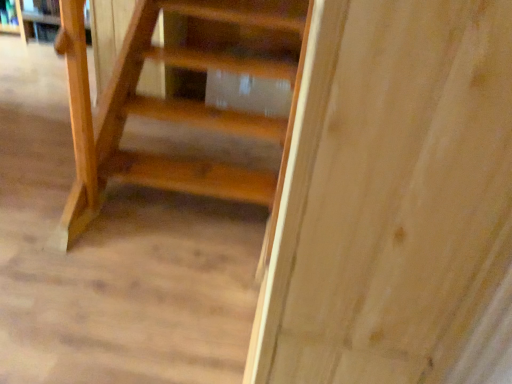
This screenshot has width=512, height=384. Describe the element at coordinates (42, 7) in the screenshot. I see `matte wooden book at upper left` at that location.

Identify the location of matte wooden book at upper left. (42, 7).

This screenshot has height=384, width=512. Describe the element at coordinates (23, 19) in the screenshot. I see `wooden shelf at upper left` at that location.

This screenshot has height=384, width=512. Find the location of `wooden shelf at upper left`. wooden shelf at upper left is located at coordinates (23, 19).

The width and height of the screenshot is (512, 384). What are the coordinates of `matte wooden book at upper left` in the screenshot? It's located at (42, 7).

Which is more to the right, matte wooden book at upper left or wooden shelf at upper left?

wooden shelf at upper left.

Between matte wooden book at upper left and wooden shelf at upper left, which one is positioned in front?

wooden shelf at upper left is in front.

Is point (32, 1) positioned in front of point (32, 22)?

That is True.

From the image's perspective, which one is positioned lower, matte wooden book at upper left or wooden shelf at upper left?

From the image's view, matte wooden book at upper left is below.

In the scene shown: From a real-world perspective, is matte wooden book at upper left physically located above or below wooden shelf at upper left?

In terms of real-world spatial position, matte wooden book at upper left is above wooden shelf at upper left.

Looking at this image, is matte wooden book at upper left wider or thinner than wooden shelf at upper left?

Considering their sizes, matte wooden book at upper left looks slimmer than wooden shelf at upper left.

Which of these two, matte wooden book at upper left or wooden shelf at upper left, stands taller?

With more height is wooden shelf at upper left.

In terms of size, does matte wooden book at upper left appear bigger or smaller than wooden shelf at upper left?

matte wooden book at upper left is smaller than wooden shelf at upper left.

Is matte wooden book at upper left completely or partially outside of wooden shelf at upper left?

No, matte wooden book at upper left is not outside of wooden shelf at upper left.

Is there a large distance between matte wooden book at upper left and wooden shelf at upper left?

A: No, matte wooden book at upper left is in close proximity to wooden shelf at upper left.

Is matte wooden book at upper left turned away from wooden shelf at upper left?

Yes, matte wooden book at upper left is positioned with its back facing wooden shelf at upper left.

How many degrees apart are the facing directions of matte wooden book at upper left and wooden shelf at upper left?

matte wooden book at upper left and wooden shelf at upper left are facing 0.078 degrees away from each other.

How far apart are matte wooden book at upper left and wooden shelf at upper left?

matte wooden book at upper left and wooden shelf at upper left are 10.36 centimeters apart from each other.

I want to click on shelf above the matte wooden book at upper left (from the image's perspective), so click(23, 19).

Which is more to the right, wooden shelf at upper left or matte wooden book at upper left?

Positioned to the right is wooden shelf at upper left.

Is the position of wooden shelf at upper left more distant than that of matte wooden book at upper left?

No.

Considering the positions of points (52, 21) and (51, 6), is point (52, 21) closer to camera compared to point (51, 6)?

No, it is not.

From the image's perspective, which object appears higher, wooden shelf at upper left or matte wooden book at upper left?

wooden shelf at upper left.

From a real-world perspective, is wooden shelf at upper left located higher than matte wooden book at upper left?

Actually, wooden shelf at upper left is physically below matte wooden book at upper left in the real world.

Which object is wider, wooden shelf at upper left or matte wooden book at upper left?

Wider between the two is wooden shelf at upper left.

Does wooden shelf at upper left have a greater height compared to matte wooden book at upper left?

Indeed, wooden shelf at upper left has a greater height compared to matte wooden book at upper left.

Is wooden shelf at upper left smaller than matte wooden book at upper left?

No, wooden shelf at upper left is not smaller than matte wooden book at upper left.

Is matte wooden book at upper left located within wooden shelf at upper left?

Yes, matte wooden book at upper left is a part of wooden shelf at upper left.

Is wooden shelf at upper left touching matte wooden book at upper left?

No, wooden shelf at upper left is not touching matte wooden book at upper left.

Is wooden shelf at upper left turned away from matte wooden book at upper left?

wooden shelf at upper left does not have its back to matte wooden book at upper left.

Can you tell me how much wooden shelf at upper left and matte wooden book at upper left differ in facing direction?

They differ by 0.078 degrees in their facing directions.

Locate an element on the screen. Image resolution: width=512 pixels, height=384 pixels. book below the wooden shelf at upper left (from the image's perspective) is located at coordinates (42, 7).

Locate an element on the screen. Image resolution: width=512 pixels, height=384 pixels. shelf in front of the matte wooden book at upper left is located at coordinates (23, 19).

Where is `shelf on the right of the matte wooden book at upper left`? This screenshot has width=512, height=384. shelf on the right of the matte wooden book at upper left is located at coordinates [23, 19].